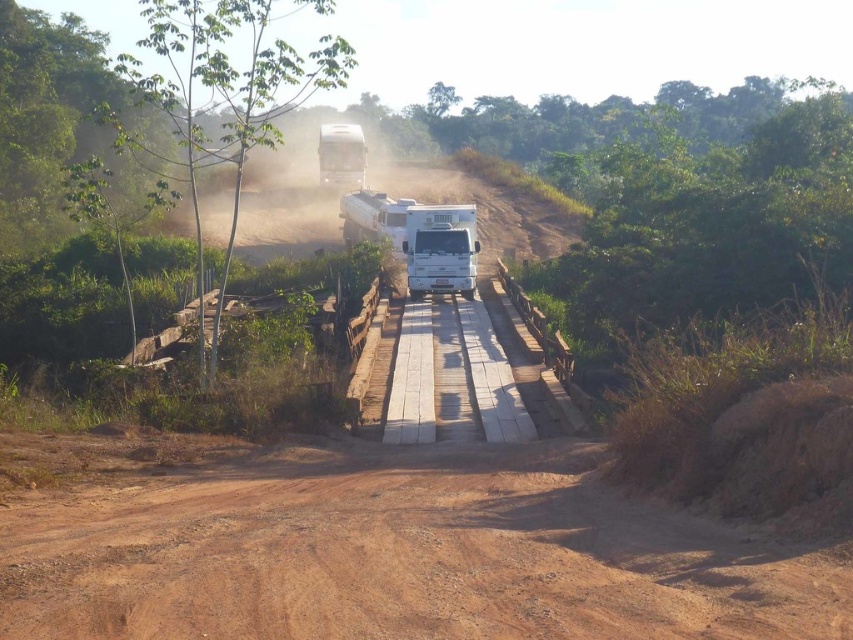
You are driving a white matte truck at center and need to cross the brown dirt track at center. Can you safely navigate the truck onto the dirt track without getting stuck?

The brown dirt track at center occupies less space than the white matte truck at center. This means the truck may not fit properly, so there is a risk of getting stuck. It is advisable to proceed with caution or look for an alternative route.

You are driving a white matte recreational vehicle at center and want to cross the brown dirt track at center. Can you safely pass through the track if the vehicle is as wide as the track?

The brown dirt track at center might be wider than white matte recreational vehicle at center, so there is a possibility that the vehicle can pass safely if it stays centered and avoids the edges.

You are a delivery driver approaching the wooden bridge on the dirt road. You see a white matte recreational vehicle at center and a white matte truck at center. Which vehicle should you avoid hitting if you need to stop suddenly?

You should avoid hitting the white matte recreational vehicle at center because it is closer to you than the white matte truck at center.